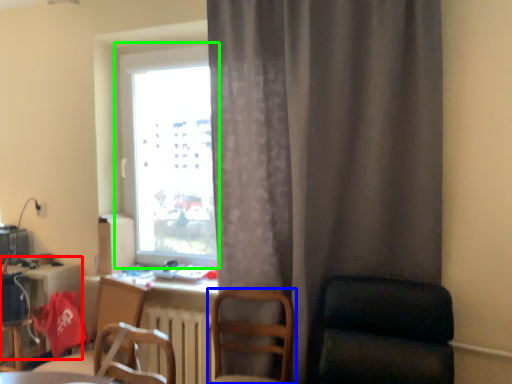
Question: Based on their relative distances, which object is nearer to computer desk (highlighted by a red box)? Choose from chair (highlighted by a blue box) and window (highlighted by a green box).

Choices:
 (A) chair
 (B) window

Answer: (B)